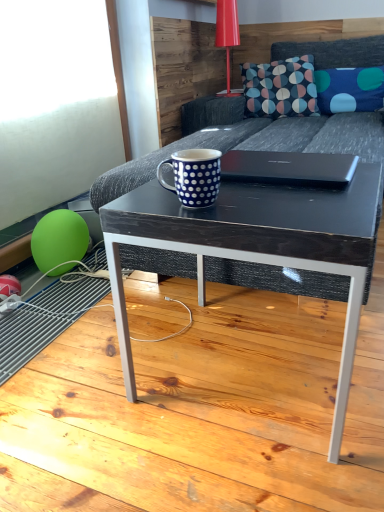
The image size is (384, 512). I want to click on vacant space in front of black matte laptop at center, so click(291, 201).